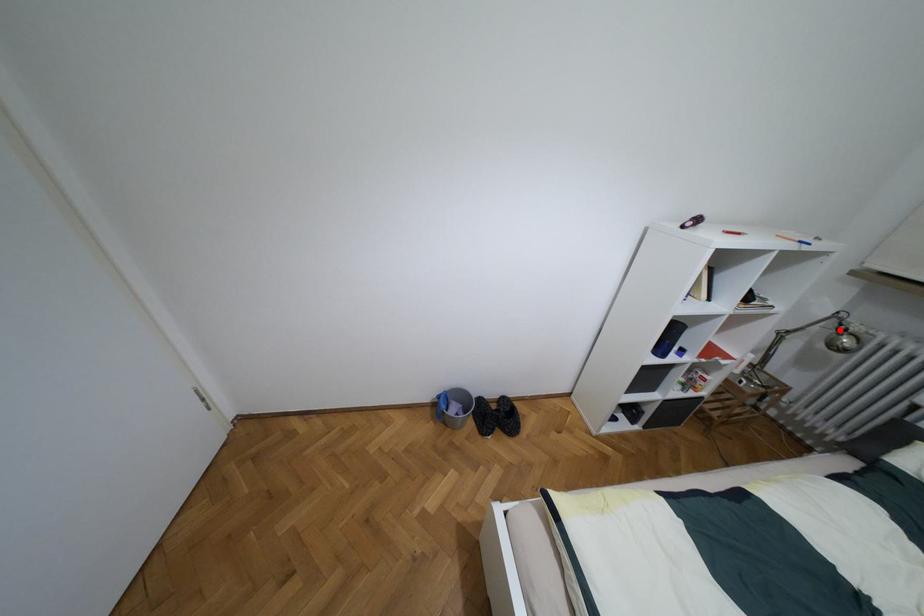
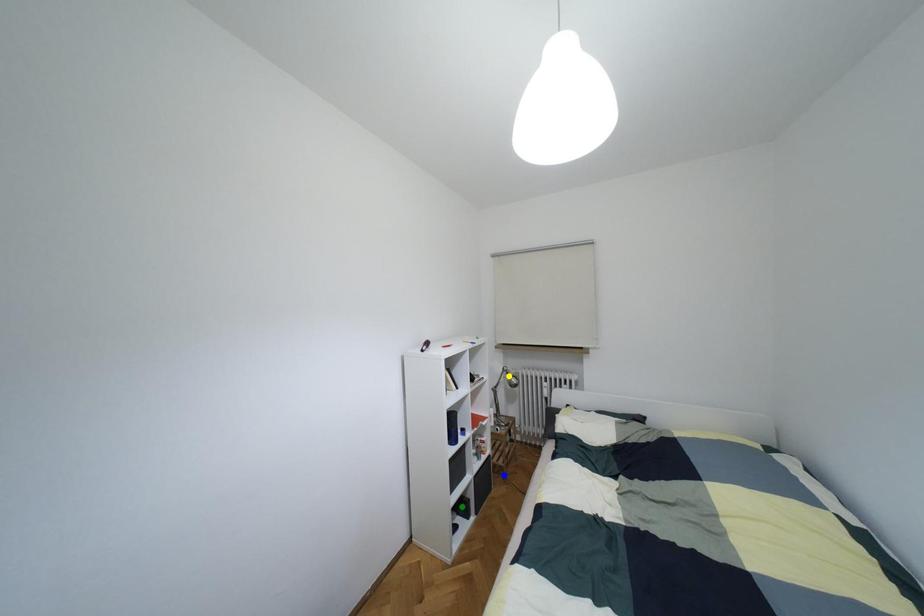
Question: I am providing you with two images of the same scene from different viewpoints. A red point is marked on the first image. You are given multiple points on the second image. Which point in image 2 is actually the same real-world point as the red point in image 1?

Choices:
 (A) blue point
 (B) green point
 (C) yellow point

Answer: (C)